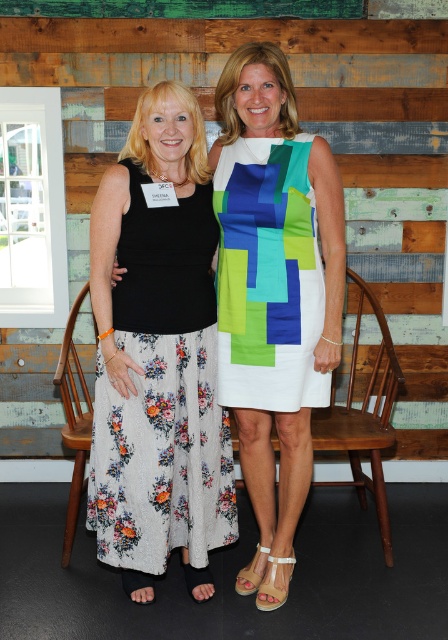
You are a photographer setting up for a shoot. You need to position a light source to the left of the floral cotton dress at left and to the right of the wooden paneling at upper center. Is this possible based on their positions?

The wooden paneling at upper center is to the right of the floral cotton dress at left, so placing a light source to the left of the floral cotton dress at left would also be to the left of the wooden paneling at upper center. Therefore, it is not possible to position the light source between them as required.

You are taking a photo of the two women in the scene. The wooden paneling at upper center is an important background element. To ensure it is fully visible in the photo, where should you position the camera relative to the women?

The wooden paneling at upper center is located at point (305,128), so you should position the camera so that the paneling is centered in the frame to ensure it is fully visible.

You are taking a photo of two women standing in a rustic setting. You notice two specific points in the scene at coordinates point (232,115) and point (214,182). Which of these points is closer to the camera?

Point (232,115) is closer to the camera than point (214,182).